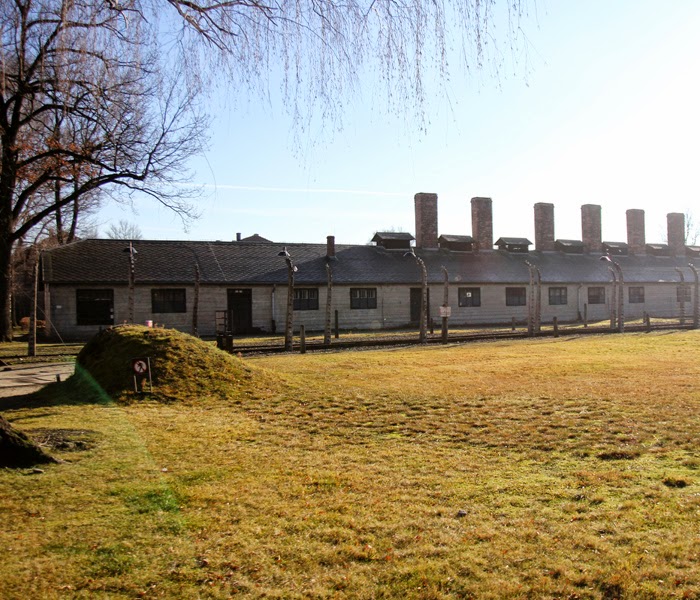
Where is `door`? door is located at coordinates (239, 310), (418, 303).